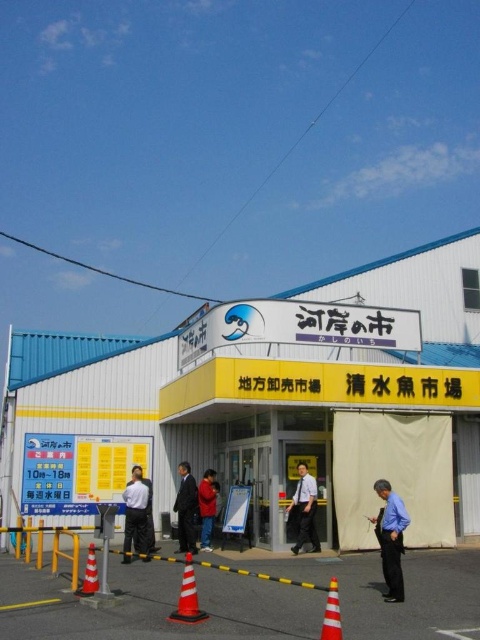
Question: Considering the relative positions of blue shirt at lower center and orange plastic traffic cone at center in the image provided, where is blue shirt at lower center located with respect to orange plastic traffic cone at center?

Choices:
 (A) right
 (B) left

Answer: (A)

Question: Among these points, which one is farthest from the camera?

Choices:
 (A) pyautogui.click(x=184, y=547)
 (B) pyautogui.click(x=322, y=452)
 (C) pyautogui.click(x=133, y=499)
 (D) pyautogui.click(x=197, y=492)

Answer: (D)

Question: Among these objects, which one is farthest from the camera?

Choices:
 (A) dark gray suit at center
 (B) light blue shirt at center

Answer: (B)

Question: Considering the relative positions of orange matte traffic cone at lower center and orange plastic traffic cone at center in the image provided, where is orange matte traffic cone at lower center located with respect to orange plastic traffic cone at center?

Choices:
 (A) right
 (B) left

Answer: (A)

Question: Which of the following is the closest to the observer?

Choices:
 (A) orange matte traffic cone at lower center
 (B) light blue shirt at center
 (C) white matte building at center

Answer: (A)

Question: Does dark gray suit at center have a smaller size compared to dark blue suit at center?

Choices:
 (A) no
 (B) yes

Answer: (A)